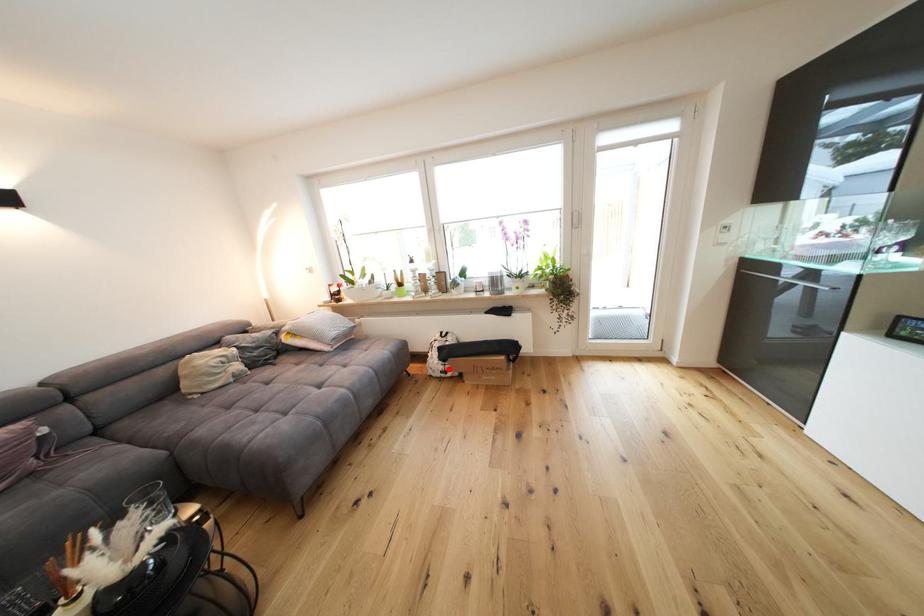
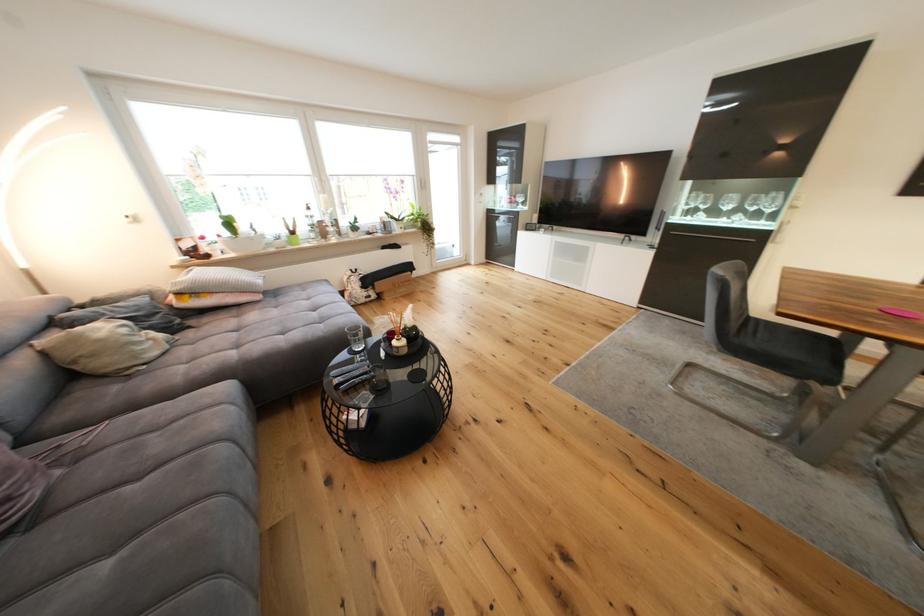
In the second image, find the point that corresponds to the highlighted location in the first image.

(372, 296)